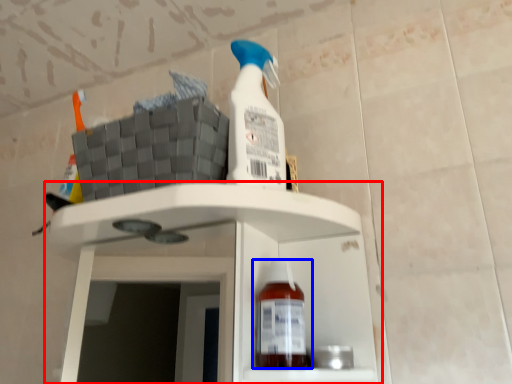
Question: Which object is closer to the camera taking this photo, shelf (highlighted by a red box) or bottle (highlighted by a blue box)?

Choices:
 (A) shelf
 (B) bottle

Answer: (A)